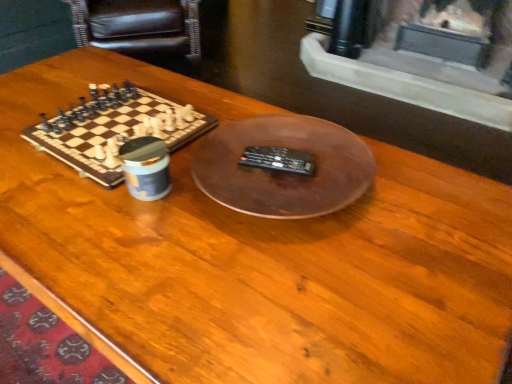
This screenshot has width=512, height=384. What are the coordinates of `black leather armchair at upper left` in the screenshot? It's located at (138, 25).

The height and width of the screenshot is (384, 512). Describe the element at coordinates (138, 25) in the screenshot. I see `black leather armchair at upper left` at that location.

In order to face black leather armchair at upper left, should I rotate leftwards or rightwards?

Rotate your view left by about 15.647°.

Locate an element on the screen. The width and height of the screenshot is (512, 384). wooden chessboard at left is located at coordinates (114, 128).

This screenshot has width=512, height=384. Describe the element at coordinates (114, 128) in the screenshot. I see `wooden chessboard at left` at that location.

What are the coordinates of `black leather armchair at upper left` in the screenshot? It's located at (138, 25).

Can you confirm if black leather armchair at upper left is positioned to the left of wooden chessboard at left?

Correct, you'll find black leather armchair at upper left to the left of wooden chessboard at left.

In the scene shown: Relative to wooden chessboard at left, is black leather armchair at upper left in front or behind?

In the image, black leather armchair at upper left appears behind wooden chessboard at left.

Which is behind, point (76, 41) or point (158, 117)?

Positioned behind is point (76, 41).

From the image's perspective, does black leather armchair at upper left appear lower than wooden chessboard at left?

Incorrect, from the image's perspective, black leather armchair at upper left is higher than wooden chessboard at left.

From a real-world perspective, who is located higher, black leather armchair at upper left or wooden chessboard at left?

wooden chessboard at left is physically above.

Is black leather armchair at upper left thinner than wooden chessboard at left?

No.

Is black leather armchair at upper left taller than wooden chessboard at left?

Correct, black leather armchair at upper left is much taller as wooden chessboard at left.

Which of these two, black leather armchair at upper left or wooden chessboard at left, is bigger?

Bigger between the two is black leather armchair at upper left.

Is wooden chessboard at left inside black leather armchair at upper left?

Definitely not — wooden chessboard at left is not inside black leather armchair at upper left.

Is black leather armchair at upper left positioned far away from wooden chessboard at left?

That's right, there is a large distance between black leather armchair at upper left and wooden chessboard at left.

Is black leather armchair at upper left looking in the opposite direction of wooden chessboard at left?

black leather armchair at upper left is not turned away from wooden chessboard at left.

How many degrees apart are the facing directions of black leather armchair at upper left and wooden chessboard at left?

The angular difference between black leather armchair at upper left and wooden chessboard at left is 132 degrees.

Measure the distance between black leather armchair at upper left and wooden chessboard at left.

4.25 feet.

Identify the location of board game located in front of the black leather armchair at upper left. (114, 128).

Considering the positions of objects wooden chessboard at left and black leather armchair at upper left in the image provided, who is more to the left, wooden chessboard at left or black leather armchair at upper left?

black leather armchair at upper left is more to the left.

Which object is closer to the camera taking this photo, wooden chessboard at left or black leather armchair at upper left?

wooden chessboard at left is in front.

Between point (176, 108) and point (113, 19), which one is positioned in front?

The point (176, 108) is closer.

From the image's perspective, is wooden chessboard at left below black leather armchair at upper left?

Correct, wooden chessboard at left appears lower than black leather armchair at upper left in the image.

From a real-world perspective, who is located higher, wooden chessboard at left or black leather armchair at upper left?

wooden chessboard at left is physically above.

Considering the sizes of wooden chessboard at left and black leather armchair at upper left in the image, is wooden chessboard at left wider or thinner than black leather armchair at upper left?

wooden chessboard at left is thinner than black leather armchair at upper left.

Who is shorter, wooden chessboard at left or black leather armchair at upper left?

wooden chessboard at left is shorter.

Is wooden chessboard at left bigger or smaller than black leather armchair at upper left?

Clearly, wooden chessboard at left is smaller in size than black leather armchair at upper left.

Is wooden chessboard at left spatially inside black leather armchair at upper left, or outside of it?

wooden chessboard at left is spatially situated outside black leather armchair at upper left.

Are wooden chessboard at left and black leather armchair at upper left beside each other?

No.

Is wooden chessboard at left oriented away from black leather armchair at upper left?

That's not correct — wooden chessboard at left is not looking away from black leather armchair at upper left.

Where is `armchair that is under the wooden chessboard at left (from a real-world perspective)`? This screenshot has height=384, width=512. armchair that is under the wooden chessboard at left (from a real-world perspective) is located at coordinates (138, 25).

Where is `board game that is in front of the black leather armchair at upper left`? board game that is in front of the black leather armchair at upper left is located at coordinates (114, 128).

Where is `armchair behind the wooden chessboard at left`? armchair behind the wooden chessboard at left is located at coordinates (138, 25).